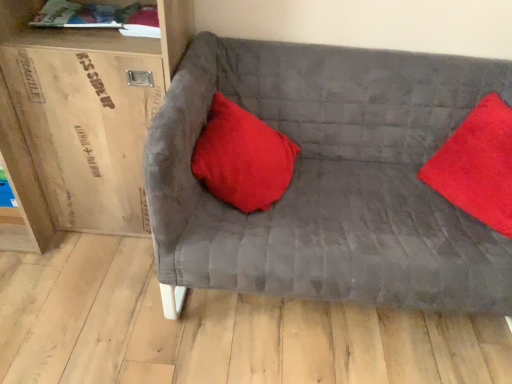
Question: Would you say satin red pillow at center, positioned as the first pillow in left-to-right order, is inside or outside hardcover book at upper left?

Choices:
 (A) inside
 (B) outside

Answer: (B)

Question: Is satin red pillow at center, the second pillow positioned from the right, wider or thinner than hardcover book at upper left?

Choices:
 (A) thin
 (B) wide

Answer: (B)

Question: Which object is positioned farthest from the hardcover book at upper left?

Choices:
 (A) satin red pillow at center, the second pillow positioned from the right
 (B) velvet red pillow at right, the 2th pillow from the left
 (C) wooden cardboard box at left
 (D) velvet gray couch at center

Answer: (B)

Question: Estimate the real-world distances between objects in this image. Which object is farther from the velvet red pillow at right, acting as the 1th pillow starting from the right?

Choices:
 (A) velvet gray couch at center
 (B) hardcover book at upper left
 (C) wooden cardboard box at left
 (D) satin red pillow at center, the second pillow positioned from the right

Answer: (B)